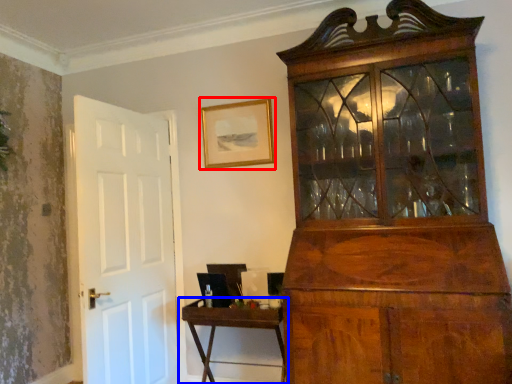
Question: Which of the following is the closest to the observer, picture frame (highlighted by a red box) or table (highlighted by a blue box)?

Choices:
 (A) picture frame
 (B) table

Answer: (B)